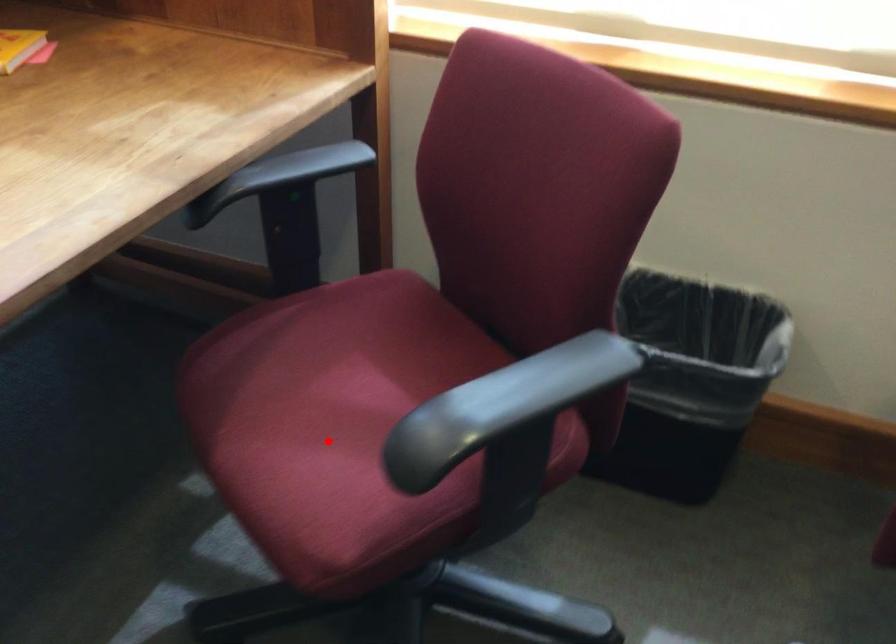
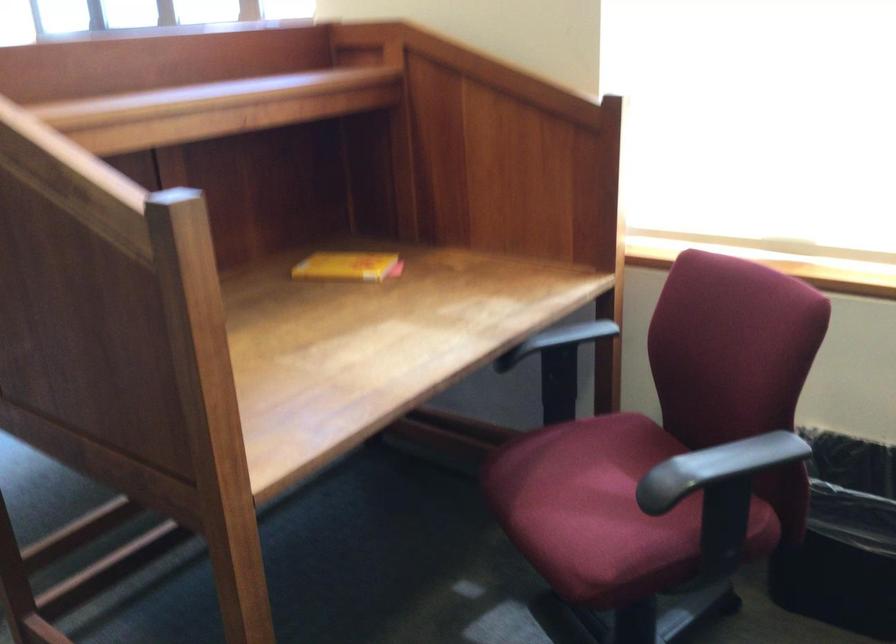
Question: I am providing you with two images of the same scene from different viewpoints. Given a red point in image1, look at the same physical point in image2. Is it:

Choices:
 (A) Closer to the viewpoint
 (B) Farther from the viewpoint

Answer: (B)